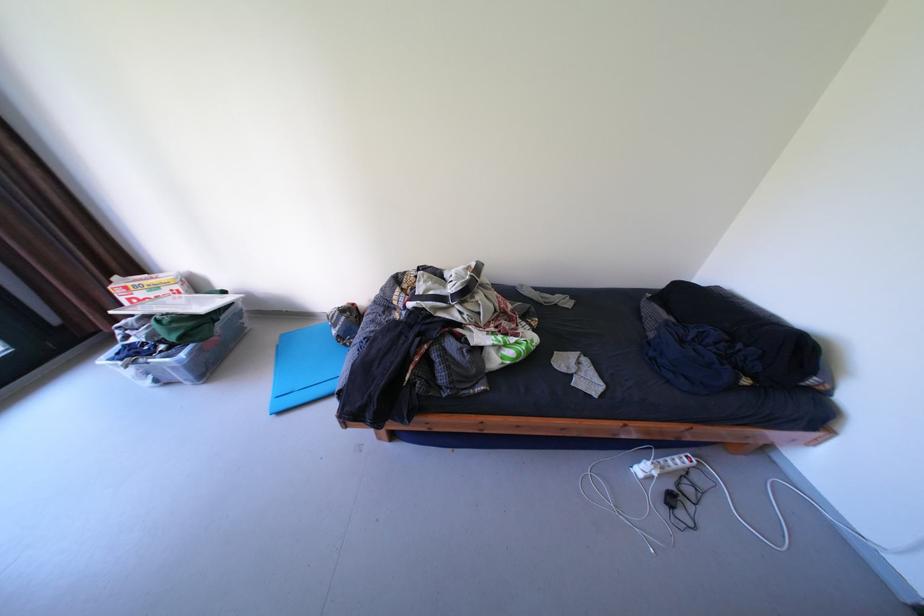
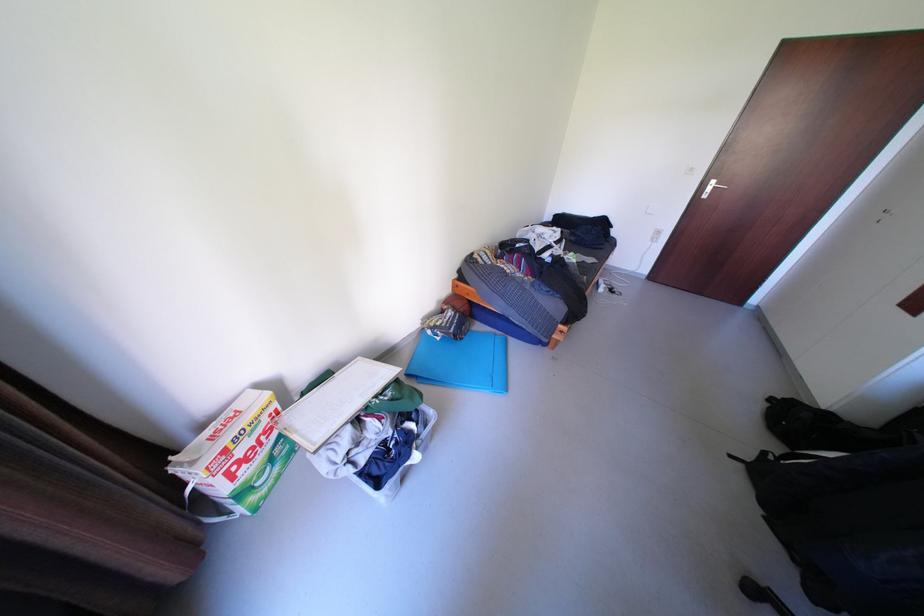
Find the pixel in the second image that matches [140,300] in the first image.

(237, 474)